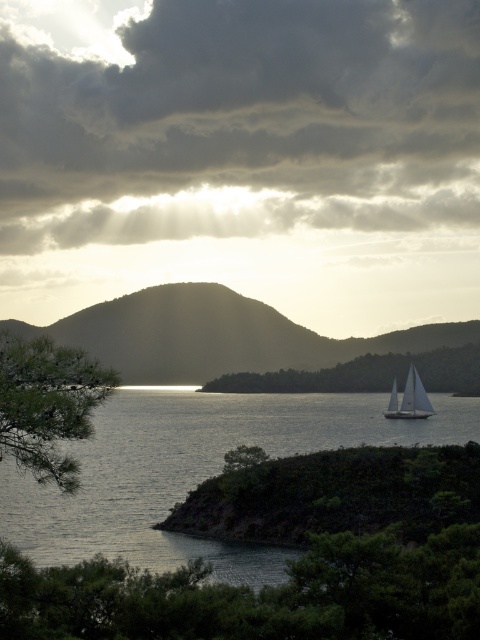
You are standing on a cliff overlooking the coastal scene. You see the clear water at center and the green matte tree at center. Which object is positioned higher in the scene?

The clear water at center is positioned higher than the green matte tree at center.

You are a photographer trying to capture the sailboat in the distance. You notice the clear water at center and the green matte tree at center. Which object is closer to the sailboat?

The clear water at center is positioned on the left side of green matte tree at center. Since the sailboat is at the horizon, the green matte tree at center is closer to the photographer and the clear water at center is closer to the sailboat.